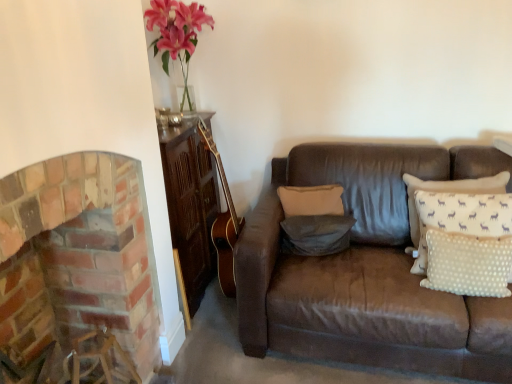
What is the approximate width of brick fireplace at left?

brick fireplace at left is 42.62 centimeters in width.

Describe the element at coordinates (311, 200) in the screenshot. I see `beige fabric pillow at center, which is the third pillow from front to back` at that location.

Locate an element on the screen. The image size is (512, 384). gray fabric pillow at center, the 2th pillow in the back-to-front sequence is located at coordinates (316, 234).

Find the location of `brick fireplace at left`. brick fireplace at left is located at coordinates (80, 253).

Based on the photo, is gray fabric pillow at center, placed as the second pillow when sorted from front to back, in front of or behind brick fireplace at left in the image?

gray fabric pillow at center, placed as the second pillow when sorted from front to back, is positioned farther from the viewer than brick fireplace at left.

Which object is positioned more to the left, gray fabric pillow at center, placed as the second pillow when sorted from front to back, or brick fireplace at left?

From the viewer's perspective, brick fireplace at left appears more on the left side.

Is brick fireplace at left located within gray fabric pillow at center, the 2th pillow in the back-to-front sequence?

No, gray fabric pillow at center, the 2th pillow in the back-to-front sequence, does not contain brick fireplace at left.

From a real-world perspective, does gray fabric pillow at center, the 2th pillow in the back-to-front sequence, sit lower than brick fireplace at left?

Yes, from a real-world perspective, gray fabric pillow at center, the 2th pillow in the back-to-front sequence, is beneath brick fireplace at left.

Consider the image. Is white dotted fabric pillow at right, marked as the 1th pillow in a front-to-back arrangement, at the back of gray fabric pillow at center, the 2th pillow in the back-to-front sequence?

No, gray fabric pillow at center, the 2th pillow in the back-to-front sequence,'s orientation is not away from white dotted fabric pillow at right, marked as the 1th pillow in a front-to-back arrangement.

This screenshot has width=512, height=384. What are the coordinates of `pillow lying in front of the gray fabric pillow at center, the 2th pillow in the back-to-front sequence` in the screenshot? It's located at (468, 264).

Which of these two, gray fabric pillow at center, the 2th pillow in the back-to-front sequence, or white dotted fabric pillow at right, marked as the 1th pillow in a front-to-back arrangement, stands taller?

white dotted fabric pillow at right, marked as the 1th pillow in a front-to-back arrangement, is taller.

From a real-world perspective, between gray fabric pillow at center, placed as the second pillow when sorted from front to back, and white dotted fabric pillow at right, marked as the 1th pillow in a front-to-back arrangement, who is vertically lower?

gray fabric pillow at center, placed as the second pillow when sorted from front to back, from a real-world perspective.

What's the angular difference between white dotted fabric pillow at right, marked as the 1th pillow in a front-to-back arrangement, and brick fireplace at left's facing directions?

The facing directions of white dotted fabric pillow at right, marked as the 1th pillow in a front-to-back arrangement, and brick fireplace at left are 98.2 degrees apart.

Is white dotted fabric pillow at right, the 3th pillow viewed from the back, directly adjacent to brick fireplace at left?

white dotted fabric pillow at right, the 3th pillow viewed from the back, and brick fireplace at left are not in contact.

Considering the positions of objects white dotted fabric pillow at right, marked as the 1th pillow in a front-to-back arrangement, and brick fireplace at left in the image provided, who is more to the left, white dotted fabric pillow at right, marked as the 1th pillow in a front-to-back arrangement, or brick fireplace at left?

brick fireplace at left is more to the left.

Does white dotted fabric pillow at right, marked as the 1th pillow in a front-to-back arrangement, contain brick fireplace at left?

That's incorrect, brick fireplace at left is not inside white dotted fabric pillow at right, marked as the 1th pillow in a front-to-back arrangement.

Is beige fabric pillow at center, which is the third pillow from front to back, not inside gray fabric pillow at center, the 2th pillow in the back-to-front sequence?

Absolutely, beige fabric pillow at center, which is the third pillow from front to back, is external to gray fabric pillow at center, the 2th pillow in the back-to-front sequence.

In the scene shown: How many degrees apart are the facing directions of beige fabric pillow at center, placed as the 1th pillow when sorted from back to front, and gray fabric pillow at center, placed as the second pillow when sorted from front to back?

6.28 degrees separate the facing orientations of beige fabric pillow at center, placed as the 1th pillow when sorted from back to front, and gray fabric pillow at center, placed as the second pillow when sorted from front to back.

Can you confirm if beige fabric pillow at center, placed as the 1th pillow when sorted from back to front, is taller than gray fabric pillow at center, placed as the second pillow when sorted from front to back?

Yes, beige fabric pillow at center, placed as the 1th pillow when sorted from back to front, is taller than gray fabric pillow at center, placed as the second pillow when sorted from front to back.

Considering the relative positions of beige fabric pillow at center, placed as the 1th pillow when sorted from back to front, and gray fabric pillow at center, the 2th pillow in the back-to-front sequence, in the image provided, is beige fabric pillow at center, placed as the 1th pillow when sorted from back to front, to the left of gray fabric pillow at center, the 2th pillow in the back-to-front sequence, from the viewer's perspective?

Yes, beige fabric pillow at center, placed as the 1th pillow when sorted from back to front, is to the left of gray fabric pillow at center, the 2th pillow in the back-to-front sequence.

Is beige fabric pillow at center, which is the third pillow from front to back, positioned in front of brick fireplace at left?

No, the depth of beige fabric pillow at center, which is the third pillow from front to back, is greater than that of brick fireplace at left.

Is beige fabric pillow at center, which is the third pillow from front to back, wider than brick fireplace at left?

Incorrect, the width of beige fabric pillow at center, which is the third pillow from front to back, does not surpass that of brick fireplace at left.

From a real-world perspective, which object rests below the other?

brick fireplace at left, from a real-world perspective.

Is beige fabric pillow at center, placed as the 1th pillow when sorted from back to front, not inside white dotted fabric pillow at right, marked as the 1th pillow in a front-to-back arrangement?

Yes, beige fabric pillow at center, placed as the 1th pillow when sorted from back to front, is located beyond the bounds of white dotted fabric pillow at right, marked as the 1th pillow in a front-to-back arrangement.

Consider the image. From the image's perspective, is beige fabric pillow at center, placed as the 1th pillow when sorted from back to front, located beneath white dotted fabric pillow at right, marked as the 1th pillow in a front-to-back arrangement?

Incorrect, from the image's perspective, beige fabric pillow at center, placed as the 1th pillow when sorted from back to front, is higher than white dotted fabric pillow at right, marked as the 1th pillow in a front-to-back arrangement.

Consider the image. Is beige fabric pillow at center, placed as the 1th pillow when sorted from back to front, shorter than white dotted fabric pillow at right, marked as the 1th pillow in a front-to-back arrangement?

Yes, beige fabric pillow at center, placed as the 1th pillow when sorted from back to front, is shorter than white dotted fabric pillow at right, marked as the 1th pillow in a front-to-back arrangement.

Looking at this image, can you confirm if beige fabric pillow at center, which is the third pillow from front to back, is thinner than white dotted fabric pillow at right, marked as the 1th pillow in a front-to-back arrangement?

No.

Which is correct: brick fireplace at left is inside white dotted fabric pillow at right, the 3th pillow viewed from the back, or outside of it?

brick fireplace at left cannot be found inside white dotted fabric pillow at right, the 3th pillow viewed from the back.

From the image's perspective, is brick fireplace at left positioned above or below white dotted fabric pillow at right, marked as the 1th pillow in a front-to-back arrangement?

brick fireplace at left is situated lower than white dotted fabric pillow at right, marked as the 1th pillow in a front-to-back arrangement, in the image.

Who is taller, brick fireplace at left or white dotted fabric pillow at right, the 3th pillow viewed from the back?

brick fireplace at left.

Does brick fireplace at left have a larger size compared to white dotted fabric pillow at right, marked as the 1th pillow in a front-to-back arrangement?

Yes, brick fireplace at left is bigger than white dotted fabric pillow at right, marked as the 1th pillow in a front-to-back arrangement.

The width and height of the screenshot is (512, 384). I want to click on the 2nd pillow positioned below the brick fireplace at left (from a real-world perspective), so click(316, 234).

The width and height of the screenshot is (512, 384). Find the location of `the 1st pillow located above the gray fabric pillow at center, placed as the second pillow when sorted from front to back (from a real-world perspective)`. the 1st pillow located above the gray fabric pillow at center, placed as the second pillow when sorted from front to back (from a real-world perspective) is located at coordinates (468, 264).

Considering their positions, is beige fabric pillow at center, which is the third pillow from front to back, positioned closer to gray fabric pillow at center, the 2th pillow in the back-to-front sequence, than brick fireplace at left?

Based on the image, beige fabric pillow at center, which is the third pillow from front to back, appears to be nearer to gray fabric pillow at center, the 2th pillow in the back-to-front sequence.

Looking at the image, which one is located further to beige fabric pillow at center, which is the third pillow from front to back, brick fireplace at left or gray fabric pillow at center, placed as the second pillow when sorted from front to back?

brick fireplace at left.

Looking at this image, looking at the image, which one is located closer to white dotted fabric pillow at right, the 3th pillow viewed from the back, gray fabric pillow at center, the 2th pillow in the back-to-front sequence, or beige fabric pillow at center, placed as the 1th pillow when sorted from back to front?

gray fabric pillow at center, the 2th pillow in the back-to-front sequence, is positioned closer to the anchor white dotted fabric pillow at right, the 3th pillow viewed from the back.

Estimate the real-world distances between objects in this image. Which object is further from gray fabric pillow at center, the 2th pillow in the back-to-front sequence, brick fireplace at left or white dotted fabric pillow at right, the 3th pillow viewed from the back?

Based on the image, brick fireplace at left appears to be further to gray fabric pillow at center, the 2th pillow in the back-to-front sequence.

From the picture: Estimate the real-world distances between objects in this image. Which object is closer to white dotted fabric pillow at right, the 3th pillow viewed from the back, brick fireplace at left or beige fabric pillow at center, which is the third pillow from front to back?

beige fabric pillow at center, which is the third pillow from front to back, lies closer to white dotted fabric pillow at right, the 3th pillow viewed from the back, than the other object.

When comparing their distances from gray fabric pillow at center, placed as the second pillow when sorted from front to back, does brick fireplace at left or beige fabric pillow at center, which is the third pillow from front to back, seem closer?

beige fabric pillow at center, which is the third pillow from front to back, lies closer to gray fabric pillow at center, placed as the second pillow when sorted from front to back, than the other object.

When comparing their distances from brick fireplace at left, does white dotted fabric pillow at right, the 3th pillow viewed from the back, or beige fabric pillow at center, which is the third pillow from front to back, seem further?

white dotted fabric pillow at right, the 3th pillow viewed from the back, lies further to brick fireplace at left than the other object.

From the picture: From the image, which object appears to be nearer to white dotted fabric pillow at right, marked as the 1th pillow in a front-to-back arrangement, gray fabric pillow at center, the 2th pillow in the back-to-front sequence, or brick fireplace at left?

gray fabric pillow at center, the 2th pillow in the back-to-front sequence.

At what (x,y) coordinates should I click in order to perform the action: click on pillow between beige fabric pillow at center, which is the third pillow from front to back, and white dotted fabric pillow at right, the 3th pillow viewed from the back, from left to right. Please return your answer as a coordinate pair (x, y). Looking at the image, I should click on (316, 234).